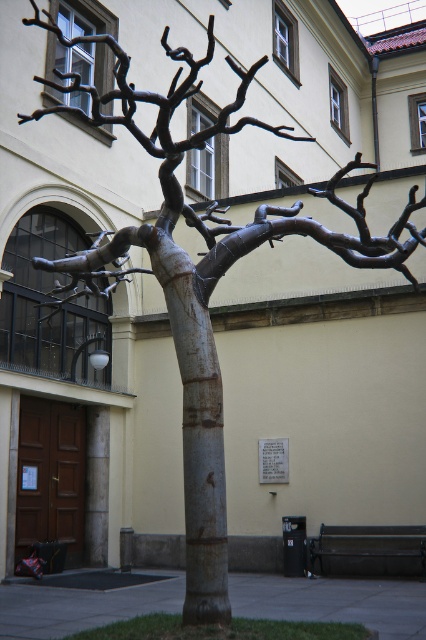
You are an artist planning to paint the sculpture in the courtyard. You need to know which part of the sculpture is narrower between the rustic wood tree trunk at center and the polished bronze branch at center. Can you tell me?

The rustic wood tree trunk at center is narrower than the polished bronze branch at center.

You are a visitor standing in the courtyard and want to take a photo of the sculpture. The rustic wood tree trunk at center and the polished bronze branch at center are both in your view. Which part of the sculpture will appear closer to you in the photo?

The rustic wood tree trunk at center will appear closer to you in the photo because it is in front of the polished bronze branch at center.